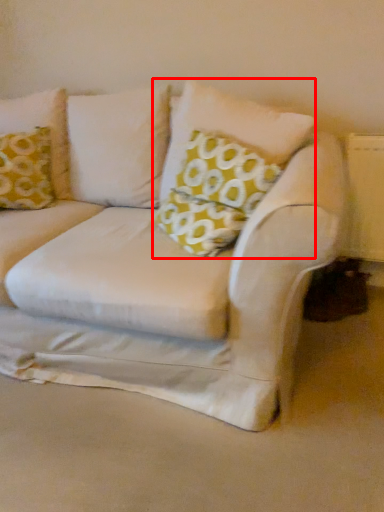
Question: Where is pillow (annotated by the red box) located in relation to pillow in the image?

Choices:
 (A) right
 (B) left

Answer: (A)